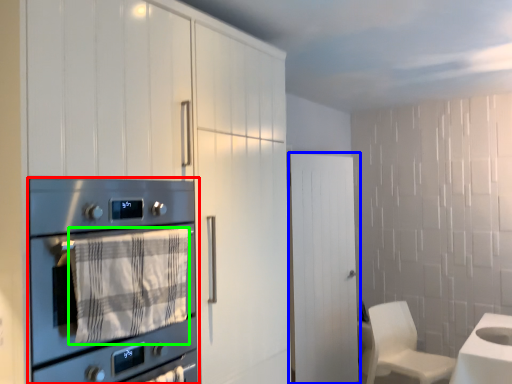
Question: Based on their relative distances, which object is nearer to home appliance (highlighted by a red box)? Choose from door (highlighted by a blue box) and blanket (highlighted by a green box).

Choices:
 (A) door
 (B) blanket

Answer: (B)